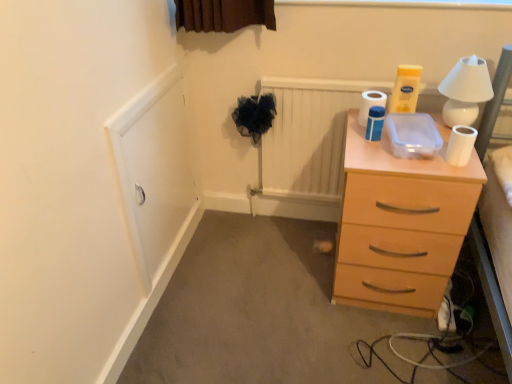
Identify the location of vacant space that's between white matte toilet paper at upper right, which ranks as the third toilet paper in left-to-right order, and white matte toilet paper at upper right, the 2th toilet paper from the back. The height and width of the screenshot is (384, 512). (421, 150).